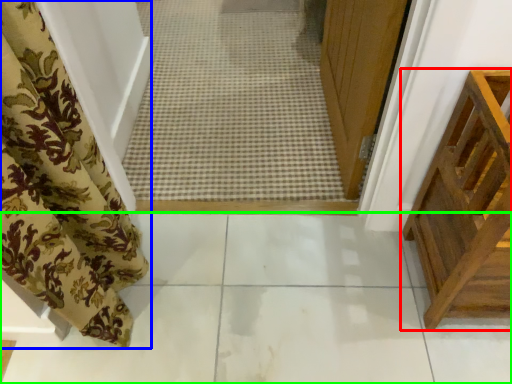
Question: Estimate the real-world distances between objects in this image. Which object is farther from furniture (highlighted by a red box), curtain (highlighted by a blue box) or path (highlighted by a green box)?

Choices:
 (A) curtain
 (B) path

Answer: (A)